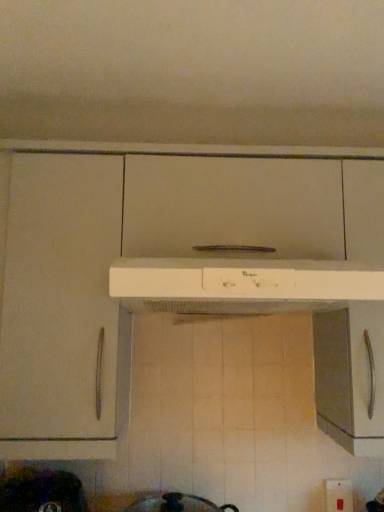
Question: Is white plastic range hood at center at the left side of metallic dark gray pot at lower left?

Choices:
 (A) no
 (B) yes

Answer: (A)

Question: Does white plastic range hood at center have a greater width compared to metallic dark gray pot at lower left?

Choices:
 (A) no
 (B) yes

Answer: (B)

Question: Is white plastic range hood at center oriented towards metallic dark gray pot at lower left?

Choices:
 (A) yes
 (B) no

Answer: (B)

Question: From the image's perspective, is white plastic range hood at center located beneath metallic dark gray pot at lower left?

Choices:
 (A) yes
 (B) no

Answer: (B)

Question: Is metallic dark gray pot at lower left a part of white plastic range hood at center?

Choices:
 (A) yes
 (B) no

Answer: (B)

Question: Is metallic dark gray pot at lower left spatially inside white plastic range hood at center, or outside of it?

Choices:
 (A) outside
 (B) inside

Answer: (A)

Question: Considering the relative positions of metallic dark gray pot at lower left and white plastic range hood at center in the image provided, is metallic dark gray pot at lower left to the left or to the right of white plastic range hood at center?

Choices:
 (A) right
 (B) left

Answer: (B)

Question: Is metallic dark gray pot at lower left in front of or behind white plastic range hood at center in the image?

Choices:
 (A) behind
 (B) front

Answer: (A)

Question: From the image's perspective, relative to white plastic range hood at center, is metallic dark gray pot at lower left above or below?

Choices:
 (A) below
 (B) above

Answer: (A)

Question: In terms of width, does metallic dark gray pot at lower left look wider or thinner when compared to white plastic electric outlet at lower right?

Choices:
 (A) wide
 (B) thin

Answer: (A)

Question: In the image, is metallic dark gray pot at lower left positioned in front of or behind white plastic electric outlet at lower right?

Choices:
 (A) front
 (B) behind

Answer: (A)

Question: From the image's perspective, is metallic dark gray pot at lower left positioned above or below white plastic electric outlet at lower right?

Choices:
 (A) below
 (B) above

Answer: (B)

Question: Would you say metallic dark gray pot at lower left is inside or outside white plastic electric outlet at lower right?

Choices:
 (A) inside
 (B) outside

Answer: (B)

Question: In the image, is white plastic electric outlet at lower right positioned in front of or behind white plastic range hood at center?

Choices:
 (A) behind
 (B) front

Answer: (A)

Question: Is point (337, 494) closer or farther from the camera than point (135, 291)?

Choices:
 (A) farther
 (B) closer

Answer: (A)